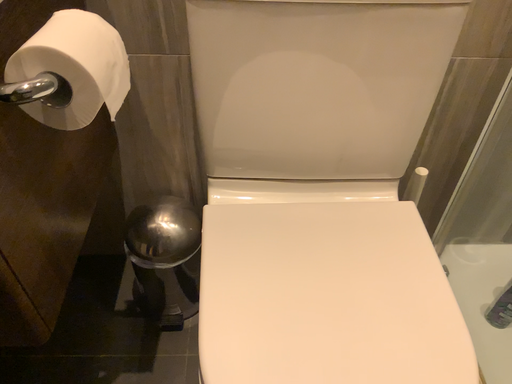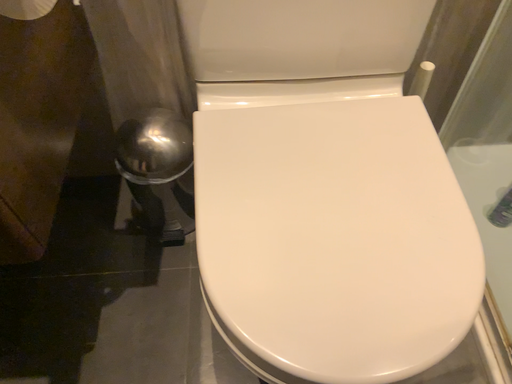
Question: How did the camera likely rotate when shooting the video?

Choices:
 (A) rotated downward
 (B) rotated upward

Answer: (A)